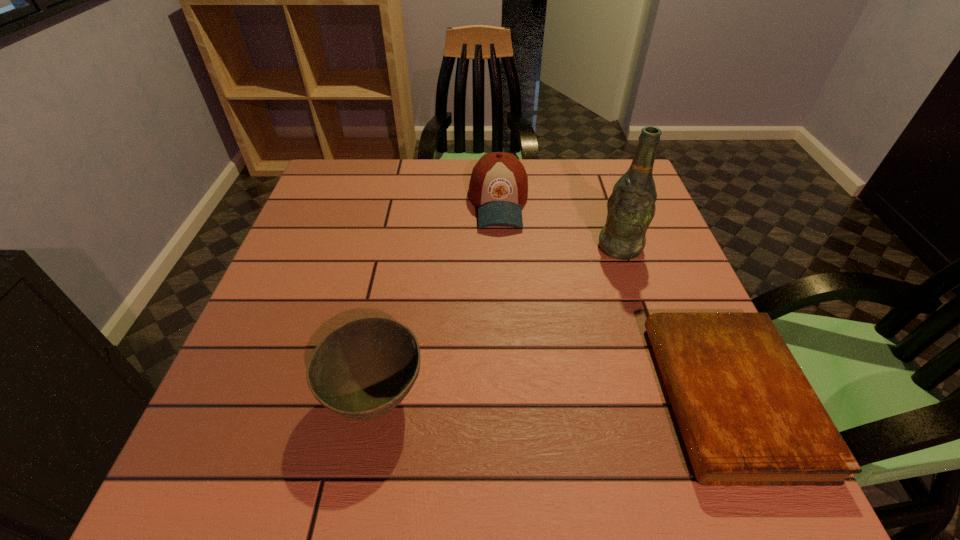
Identify the location of free spot between the leftmost object and the beer bottle. The height and width of the screenshot is (540, 960). (497, 322).

Find the location of a particular element. This screenshot has width=960, height=540. empty space that is in between the Bible and the bowl is located at coordinates (552, 397).

Locate an element on the screen. vacant area that lies between the bowl and the third object from right to left is located at coordinates (437, 300).

Locate an element on the screen. The width and height of the screenshot is (960, 540). free space between the Bible and the baseball cap is located at coordinates [613, 300].

Where is `free area in between the leftmost object and the second object from left to right`? Image resolution: width=960 pixels, height=540 pixels. free area in between the leftmost object and the second object from left to right is located at coordinates (437, 300).

Where is `vacant area between the beer bottle and the baseball cap`? vacant area between the beer bottle and the baseball cap is located at coordinates (560, 225).

Locate an element on the screen. empty space between the leftmost object and the shortest object is located at coordinates (552, 397).

You are a GUI agent. You are given a task and a screenshot of the screen. Output one action in this format:
    pyautogui.click(x=<x>, y=<y>)
    Task: Click on the object that is the closest one to the beer bottle
    Image resolution: width=960 pixels, height=540 pixels.
    Given the screenshot: What is the action you would take?
    pyautogui.click(x=498, y=185)

This screenshot has height=540, width=960. In order to click on the second closest object to the bowl in this screenshot , I will do `click(748, 416)`.

Where is `vacant space that satisfies the following two spatial constraints: 1. on the front side of the shortest object; 2. on the spine side of the baseball cap`? The width and height of the screenshot is (960, 540). vacant space that satisfies the following two spatial constraints: 1. on the front side of the shortest object; 2. on the spine side of the baseball cap is located at coordinates (509, 397).